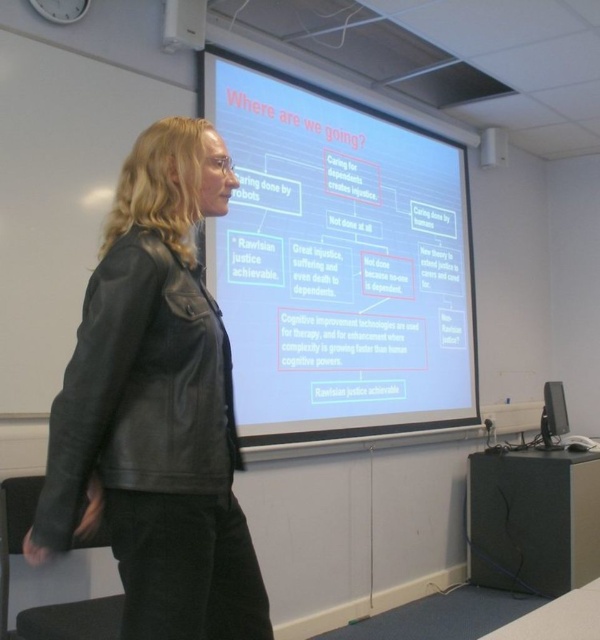
You are a student sitting at the back of the classroom. The teacher is wearing a black leather jacket at left and is standing near a white matte projection screen at upper center. You need to hand them a note. The note is in your pocket, but you can only reach 2 meters. Can you reach the teacher?

The white matte projection screen at upper center is 1.85 meters away from the black leather jacket at left. Since the teacher is near the screen, the distance between you and the teacher is approximately 1.85 meters. Since your reach is 2 meters, you can reach the teacher.

You are a student carrying a backpack that is 1 meter wide. You need to walk through the space between the white matte projection screen at upper center and the whiteboard at upper left. Can you pass through without tilting your backpack?

The distance between the white matte projection screen at upper center and the whiteboard at upper left is 1.12 meters. Since your backpack is 1 meter wide, you can pass through the space without tilting your backpack as there is enough clearance.